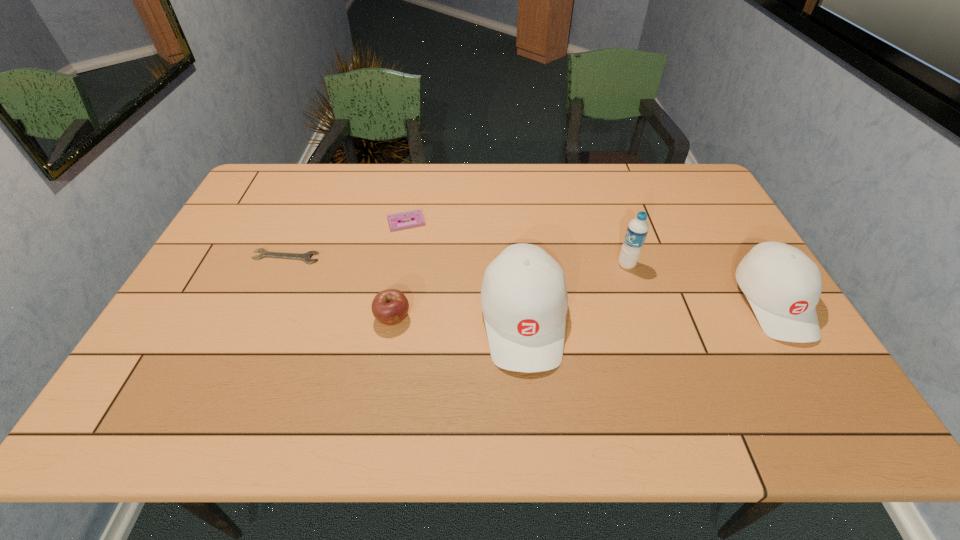
The height and width of the screenshot is (540, 960). I want to click on vacant space that is in between the right baseball cap and the fifth tallest object, so click(x=589, y=262).

Where is `blank region between the second object from right to left and the wrench`? The image size is (960, 540). blank region between the second object from right to left and the wrench is located at coordinates (456, 261).

Image resolution: width=960 pixels, height=540 pixels. What are the coordinates of `free space between the water bottle and the videotape` in the screenshot? It's located at (516, 243).

Image resolution: width=960 pixels, height=540 pixels. What are the coordinates of `empty space between the videotape and the fourth shortest object` in the screenshot? It's located at (589, 262).

Locate an element on the screen. free space between the water bottle and the videotape is located at coordinates tap(516, 243).

Locate an element on the screen. vacant region between the videotape and the third shortest object is located at coordinates (399, 270).

Image resolution: width=960 pixels, height=540 pixels. What are the coordinates of `the closest object to the wrench` in the screenshot? It's located at coord(395,222).

Choose which object is the fourth nearest neighbor to the farthest object. Please provide its 2D coordinates. Your answer should be formatted as a tuple, i.e. [(x, y)], where the tuple contains the x and y coordinates of a point satisfying the conditions above.

[(637, 230)]

Locate an element on the screen. This screenshot has width=960, height=540. vacant space that satisfies the following two spatial constraints: 1. on the label of the second object from right to left; 2. on the side of the third shortest object with the unique marking is located at coordinates (644, 318).

At what (x,y) coordinates should I click in order to perform the action: click on free space that satisfies the following two spatial constraints: 1. on the label of the second object from right to left; 2. on the side of the fourth tallest object with the unique marking. Please return your answer as a coordinate pair (x, y). Looking at the image, I should click on tap(644, 318).